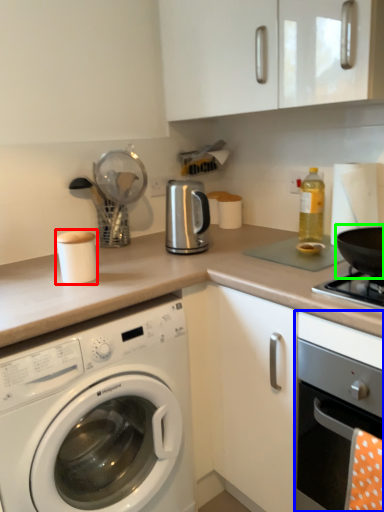
Question: Which object is the closest to the appliance (highlighted by a red box)? Choose among these: oven (highlighted by a blue box) or wok (highlighted by a green box).

Choices:
 (A) oven
 (B) wok

Answer: (A)